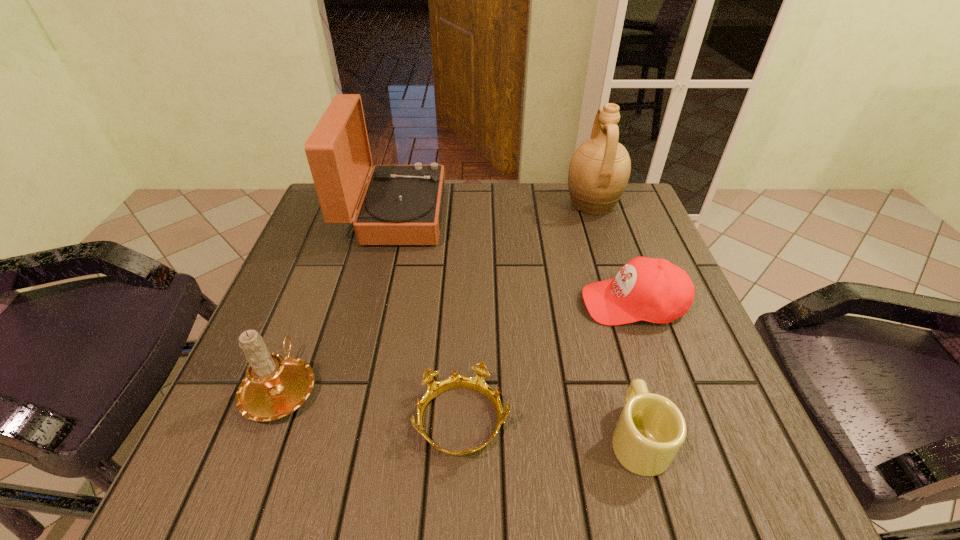
Find the location of `free space at the right edge`. free space at the right edge is located at coordinates (657, 354).

The height and width of the screenshot is (540, 960). Find the location of `free region at the far right corner`. free region at the far right corner is located at coordinates (613, 232).

You are a GUI agent. You are given a task and a screenshot of the screen. Output one action in this format:
    pyautogui.click(x=<x>, y=<y>)
    Task: Click on the free space between the mug and the candle
    The height and width of the screenshot is (540, 960).
    Given the screenshot: What is the action you would take?
    pyautogui.click(x=460, y=412)

This screenshot has width=960, height=540. What are the coordinates of `empty location between the phonograph record and the crown` in the screenshot? It's located at (428, 318).

Image resolution: width=960 pixels, height=540 pixels. In order to click on free space between the candle and the phonograph record in this screenshot , I will do `click(338, 301)`.

I want to click on vacant region between the mug and the phonograph record, so pos(516,326).

The height and width of the screenshot is (540, 960). In order to click on free spot between the pitcher and the fourth nearest object in this screenshot , I will do click(612, 253).

What are the coordinates of `unoccupied position between the crown and the third farthest object` in the screenshot? It's located at (547, 362).

Image resolution: width=960 pixels, height=540 pixels. What are the coordinates of `vacant area that lies between the second shortest object and the candle` in the screenshot? It's located at (460, 412).

The height and width of the screenshot is (540, 960). I want to click on free point between the third tallest object and the baseball cap, so pyautogui.click(x=458, y=345).